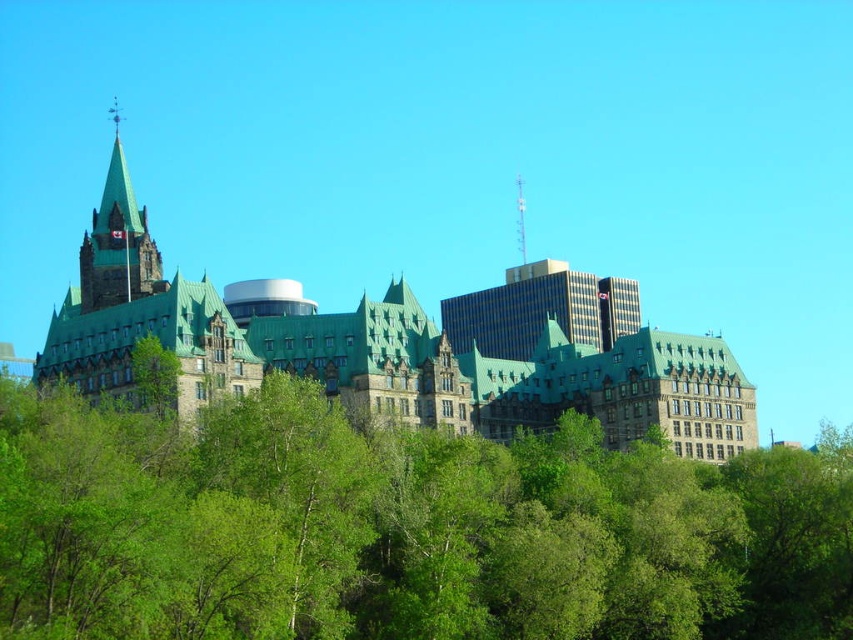
Question: Which of these objects is positioned closest to the green leafy tree at center?

Choices:
 (A) dark brown stone tower at upper left
 (B) green shingled castle at center
 (C) shiny silver spire at upper center

Answer: (B)

Question: Does green leafy tree at center have a greater width compared to green shingled castle at center?

Choices:
 (A) yes
 (B) no

Answer: (B)

Question: Which of these objects is positioned closest to the dark brown stone tower at upper left?

Choices:
 (A) green shingled castle at center
 (B) green leafy tree at center
 (C) shiny silver spire at upper center

Answer: (A)

Question: Which of the following is the closest to the observer?

Choices:
 (A) green shingled castle at center
 (B) green leafy tree at center
 (C) dark brown stone tower at upper left
 (D) shiny silver spire at upper center

Answer: (B)

Question: Can you confirm if green leafy tree at center is positioned above shiny silver spire at upper center?

Choices:
 (A) no
 (B) yes

Answer: (A)

Question: Is dark brown stone tower at upper left to the left of shiny silver spire at upper center from the viewer's perspective?

Choices:
 (A) yes
 (B) no

Answer: (A)